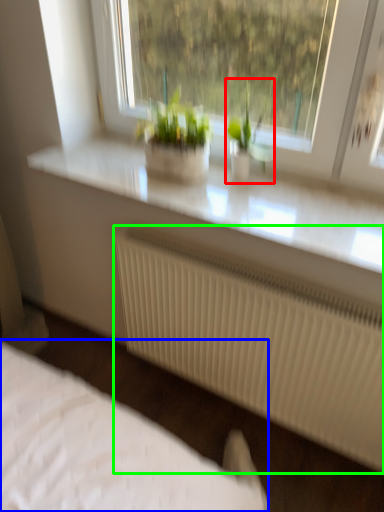
Question: Considering the real-world distances, which object is closest to houseplant (highlighted by a red box)? bed (highlighted by a blue box) or radiator (highlighted by a green box).

Choices:
 (A) bed
 (B) radiator

Answer: (B)